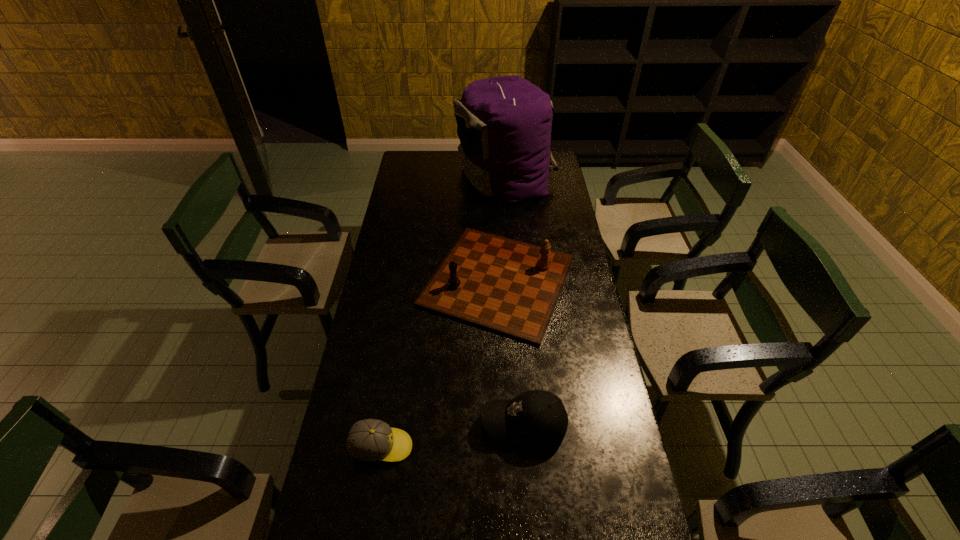
The image size is (960, 540). I want to click on object present at the far right corner, so click(x=504, y=124).

In the image, there is a desktop. Where is `free space at the far edge`? free space at the far edge is located at coordinates (438, 151).

In the image, there is a desktop. Where is `vacant space at the left edge`? The width and height of the screenshot is (960, 540). vacant space at the left edge is located at coordinates (392, 308).

Identify the location of free space at the right edge of the desktop. (580, 262).

The height and width of the screenshot is (540, 960). Find the location of `unoccupied area between the right baseball cap and the gameboard`. unoccupied area between the right baseball cap and the gameboard is located at coordinates coord(511,353).

Locate an element on the screen. This screenshot has height=540, width=960. free spot between the left baseball cap and the gameboard is located at coordinates (440, 364).

This screenshot has height=540, width=960. Identify the location of vacant area between the shorter baseball cap and the third nearest object. (440, 364).

Identify the location of free spot between the tallest object and the third nearest object. The image size is (960, 540). (502, 229).

You are a GUI agent. You are given a task and a screenshot of the screen. Output one action in this format:
    pyautogui.click(x=<x>, y=<y>)
    Task: Click on the object that is the third closest one to the left baseball cap
    
    Given the screenshot: What is the action you would take?
    pyautogui.click(x=504, y=124)

Locate an element on the screen. the closest object to the third nearest object is located at coordinates (504, 124).